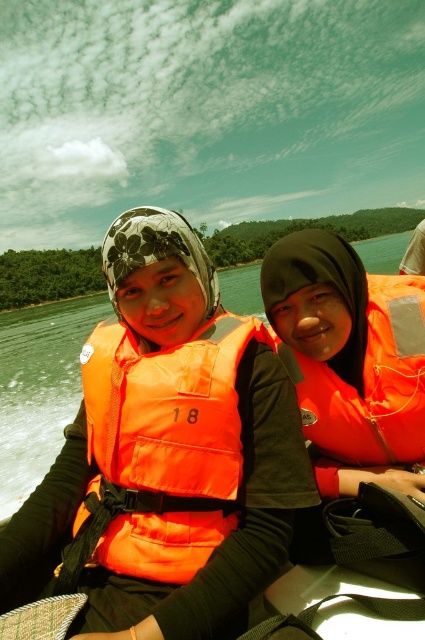
Is orange fabric life vest at center taller than orange matte life jacket at right?

Incorrect, orange fabric life vest at center's height is not larger of orange matte life jacket at right's.

Is point (200, 513) positioned before point (407, 369)?

That is True.

Who is more distant from viewer, (149, 396) or (305, 428)?

Point (305, 428)

Locate an element on the screen. The width and height of the screenshot is (425, 640). orange fabric life vest at center is located at coordinates (166, 444).

Which of these two, orange fabric life vest at center or orange life vest at center, stands taller?

orange life vest at center is taller.

Does orange fabric life vest at center appear on the right side of orange life vest at center?

Correct, you'll find orange fabric life vest at center to the right of orange life vest at center.

Between point (223, 515) and point (48, 456), which one is positioned in front?

Point (223, 515) is more forward.

This screenshot has height=640, width=425. I want to click on orange fabric life vest at center, so click(x=166, y=444).

Who is lower down, orange life vest at center or orange matte life jacket at right?

orange matte life jacket at right

Is orange life vest at center thinner than orange matte life jacket at right?

No.

The height and width of the screenshot is (640, 425). Describe the element at coordinates (39, 388) in the screenshot. I see `orange life vest at center` at that location.

You are a GUI agent. You are given a task and a screenshot of the screen. Output one action in this format:
    pyautogui.click(x=<x>, y=<y>)
    Task: Click on the orange life vest at center
    
    Given the screenshot: What is the action you would take?
    pyautogui.click(x=39, y=388)